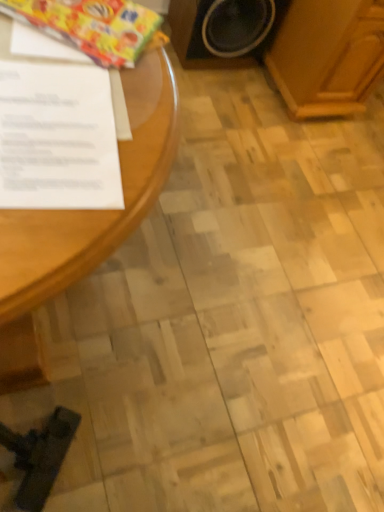
Question: Does light brown wood at upper right appear on the left side of wooden speaker at upper right?

Choices:
 (A) yes
 (B) no

Answer: (B)

Question: Considering the relative sizes of light brown wood at upper right and wooden speaker at upper right in the image provided, is light brown wood at upper right shorter than wooden speaker at upper right?

Choices:
 (A) no
 (B) yes

Answer: (A)

Question: Are light brown wood at upper right and wooden speaker at upper right making contact?

Choices:
 (A) no
 (B) yes

Answer: (A)

Question: From a real-world perspective, is light brown wood at upper right physically above wooden speaker at upper right?

Choices:
 (A) no
 (B) yes

Answer: (B)

Question: Does light brown wood at upper right appear on the right side of wooden speaker at upper right?

Choices:
 (A) yes
 (B) no

Answer: (A)

Question: Does light brown wood at upper right have a greater width compared to wooden speaker at upper right?

Choices:
 (A) no
 (B) yes

Answer: (B)

Question: Is white paper at left oriented away from light brown wood at upper right?

Choices:
 (A) yes
 (B) no

Answer: (B)

Question: Considering the relative positions of white paper at left and light brown wood at upper right in the image provided, is white paper at left in front of light brown wood at upper right?

Choices:
 (A) yes
 (B) no

Answer: (A)

Question: Are white paper at left and light brown wood at upper right making contact?

Choices:
 (A) no
 (B) yes

Answer: (A)

Question: Is white paper at left wider than light brown wood at upper right?

Choices:
 (A) no
 (B) yes

Answer: (A)

Question: Can light brown wood at upper right be found inside white paper at left?

Choices:
 (A) yes
 (B) no

Answer: (B)

Question: From a real-world perspective, does white paper at left stand above light brown wood at upper right?

Choices:
 (A) no
 (B) yes

Answer: (B)

Question: Does white paper at left turn towards shiny plastic wrapping paper at upper left?

Choices:
 (A) no
 (B) yes

Answer: (A)